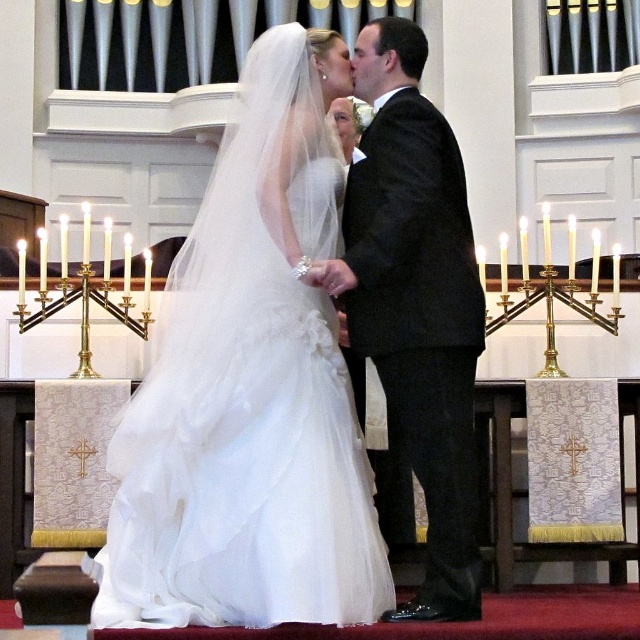
Which is more to the left, white tulle dress at center or black satin suit at center?

white tulle dress at center

Does white tulle dress at center have a greater width compared to black satin suit at center?

Yes.

Does point (266, 292) come farther from viewer compared to point (413, 308)?

That is False.

The image size is (640, 640). I want to click on white tulle dress at center, so click(x=252, y=387).